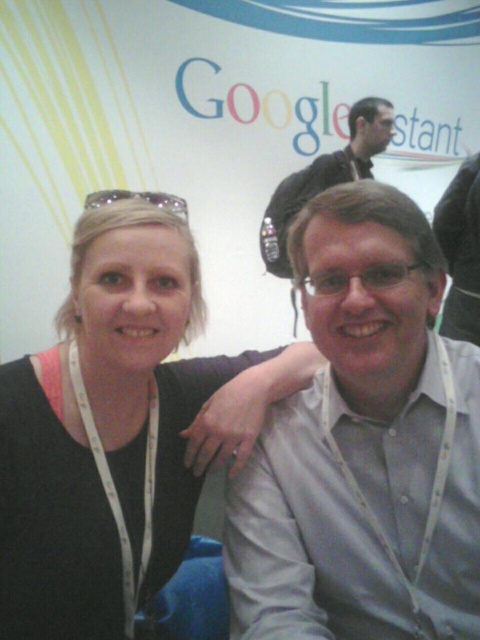
Who is higher up, black fabric at center or matte black shirt at upper center?

matte black shirt at upper center

Can you confirm if black fabric at center is bigger than matte black shirt at upper center?

No, black fabric at center is not bigger than matte black shirt at upper center.

The image size is (480, 640). Describe the element at coordinates (120, 429) in the screenshot. I see `black fabric at center` at that location.

At what (x,y) coordinates should I click in order to perform the action: click on black fabric at center. Please return your answer as a coordinate pair (x, y). Image resolution: width=480 pixels, height=640 pixels. Looking at the image, I should click on (120, 429).

Is gray shirt at center below matte black shirt at upper center?

Correct, gray shirt at center is located below matte black shirt at upper center.

What do you see at coordinates (363, 445) in the screenshot? The height and width of the screenshot is (640, 480). I see `gray shirt at center` at bounding box center [363, 445].

Image resolution: width=480 pixels, height=640 pixels. What do you see at coordinates (363, 445) in the screenshot?
I see `gray shirt at center` at bounding box center [363, 445].

This screenshot has height=640, width=480. I want to click on gray shirt at center, so click(363, 445).

Is black fabric at center closer to camera compared to metallic silver goggles at upper left?

Yes, black fabric at center is closer to the viewer.

This screenshot has height=640, width=480. What are the coordinates of `black fabric at center` in the screenshot? It's located at (120, 429).